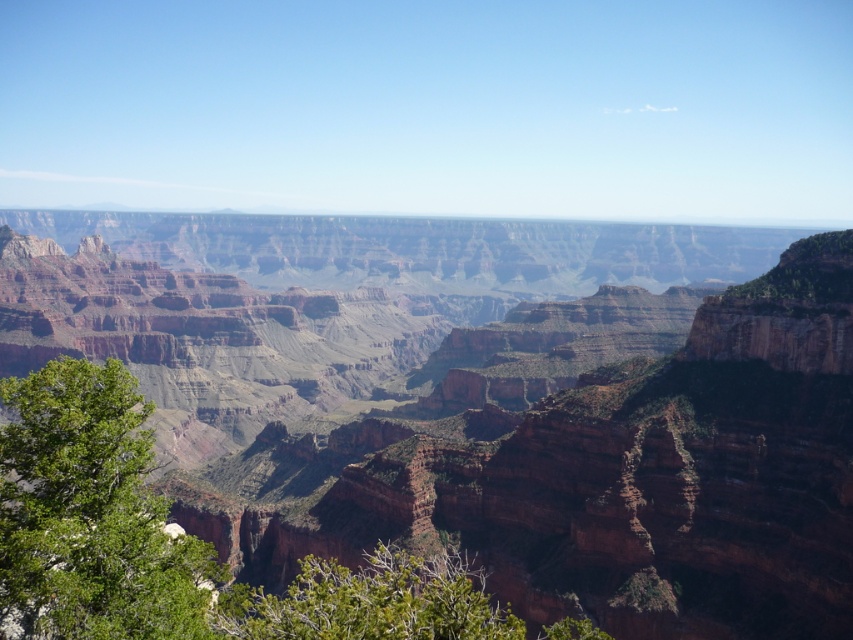
Between rustic rock canyon at center and green leafy tree at lower left, which one has less height?

green leafy tree at lower left is shorter.

Is point (743, 376) closer to viewer compared to point (90, 540)?

No, it is behind (90, 540).

Find the location of a particular element. rustic rock canyon at center is located at coordinates 590,460.

Is rustic rock canyon at center positioned at the back of green leafy tree at lower center?

Yes.

Which is more to the right, rustic rock canyon at center or green leafy tree at lower center?

From the viewer's perspective, green leafy tree at lower center appears more on the right side.

Is point (492, 577) positioned behind point (279, 600)?

Yes.

Find the location of a particular element. rustic rock canyon at center is located at coordinates (590, 460).

In the scene shown: Between green leafy tree at lower left and green leafy tree at lower center, which one is positioned higher?

Positioned higher is green leafy tree at lower left.

Does point (88, 406) come closer to viewer compared to point (308, 611)?

That is False.

The height and width of the screenshot is (640, 853). Find the location of `green leafy tree at lower left`. green leafy tree at lower left is located at coordinates (90, 515).